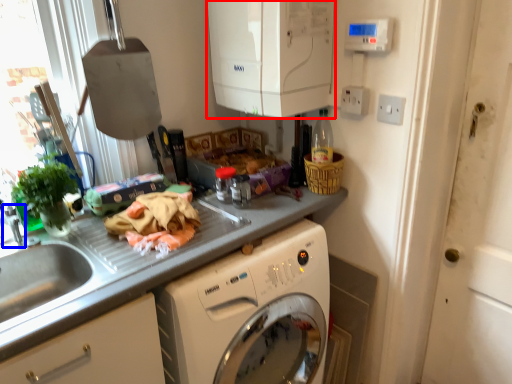
Question: Which object appears closest to the camera in this image, appliance (highlighted by a red box) or faucet (highlighted by a blue box)?

Choices:
 (A) appliance
 (B) faucet

Answer: (A)